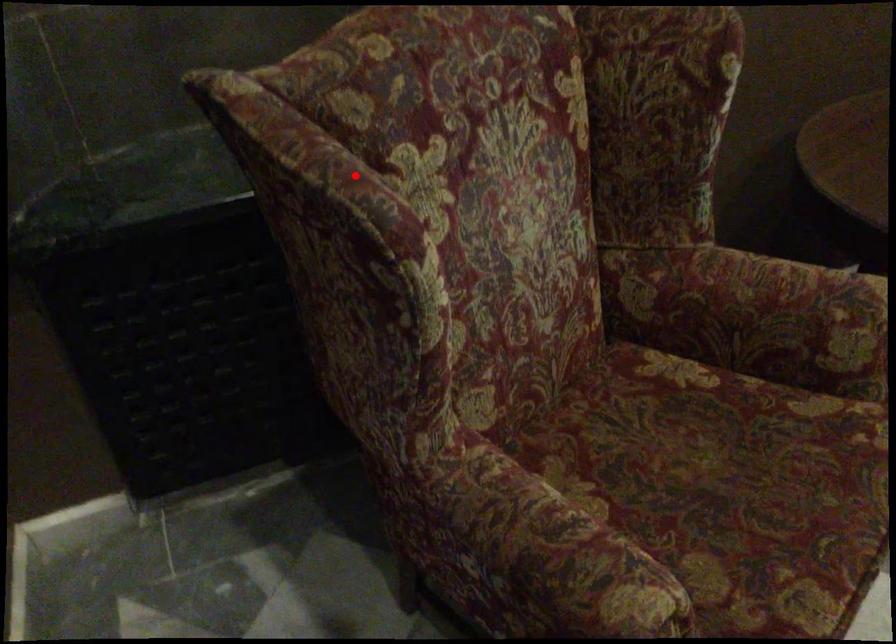
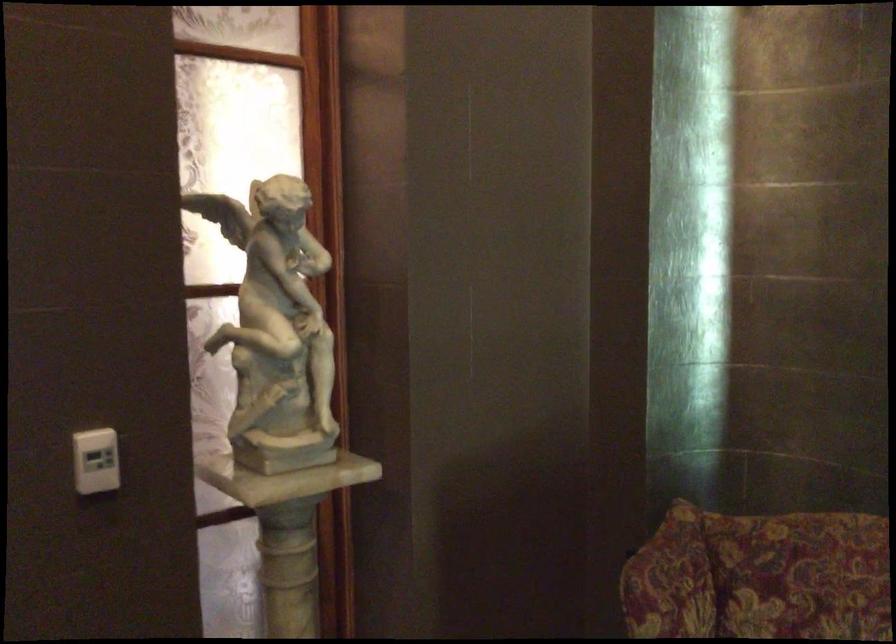
Question: I am providing you with two images of the same scene from different viewpoints. A red point is shown in image1. For the corresponding object point in image2, is it positioned nearer or farther from the camera?

Choices:
 (A) Nearer
 (B) Farther

Answer: (B)